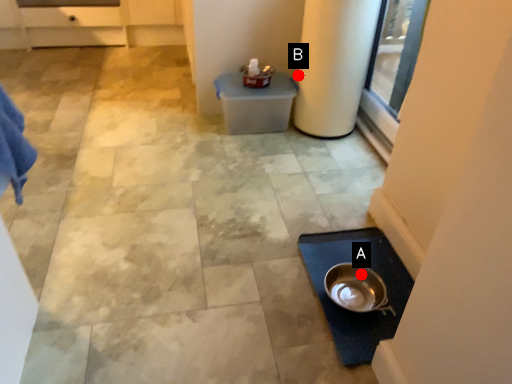
Question: Two points are circled on the image, labeled by A and B beside each circle. Which point is farther from the camera taking this photo?

Choices:
 (A) A is further
 (B) B is further

Answer: (B)